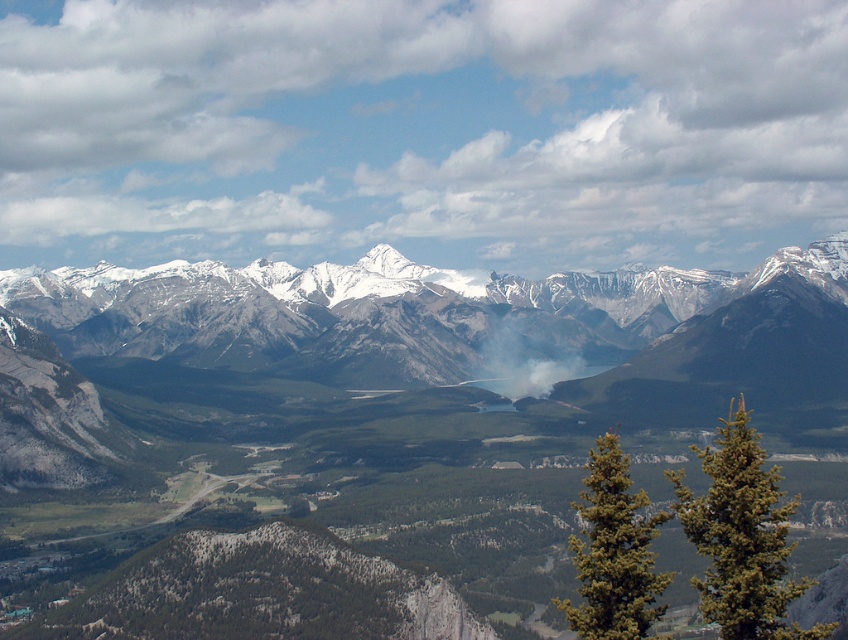
You are an outdoor photographer planning to capture a landscape shot that includes both the snowy granite mountains at center and the green textured pine tree at right. Based on their positions, will the pine tree appear in front of or behind the mountains in your photo?

The green textured pine tree at right is behind snowy granite mountains at center, so it will appear behind the mountains in your photo.